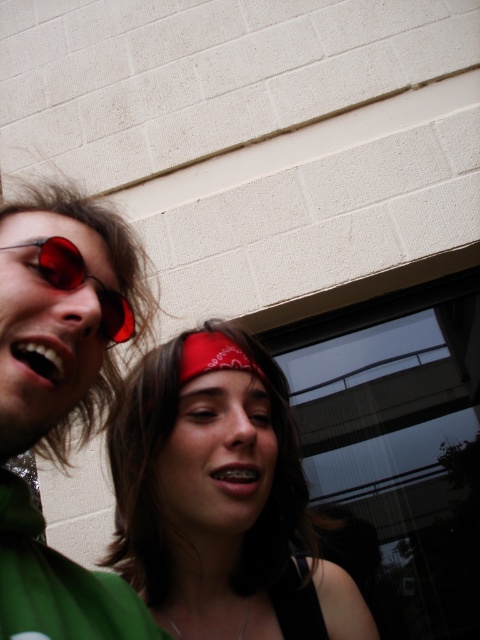
What is the exact coordinate of the red bandana at center?

The red bandana at center is located at point (218,497).

You are an observer standing in front of the beige brick wall. You see the red bandana at center and the matte red goggles at left. Which object is closer to you?

The red bandana at center is closer to you because the matte red goggles at left is behind it.

You are taking a photo of the two people in the scene. The camera is at your eye level. You want to focus on the point at point (29,360) and point (60,260). Which point should you focus on first if you want the closer one to be sharp?

Point (29,360) is closer to the camera than point (60,260), so you should focus on point (29,360) first to ensure it is sharp.